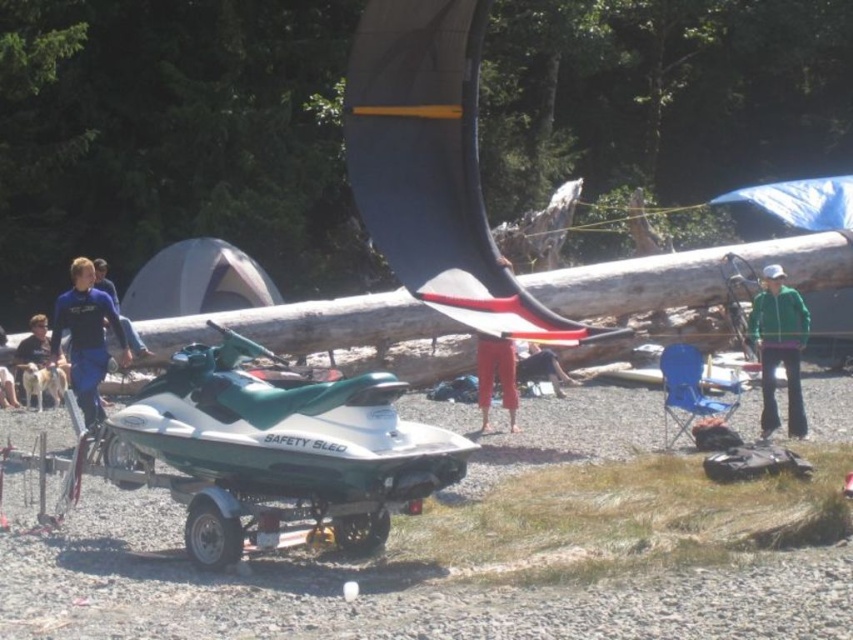
You are a photographer planning to capture a group photo of the blue wetsuit at left and the red cotton pants at center. Since you want to ensure both are visible in the frame, which clothing item should you focus on first to adjust the camera angle?

The blue wetsuit at left has a lesser height compared to red cotton pants at center, so you should focus on adjusting the camera angle to ensure the shorter blue wetsuit at left is visible in the frame.

You are a photographer positioned at the center of the scene. You want to capture a photo that includes both the dark blue fabric pants at center and the dark blue wetsuit at lower left. Given that your camera has a 50mm lens with a field of view that can capture objects within a 30 feet range, will you be able to include both subjects in the same frame?

The dark blue fabric pants at center is 18.33 feet from the dark blue wetsuit at lower left. Since the distance between them is within the 30 feet range of the camera lens, both subjects can be included in the same frame.

Consider the image. You are standing at the point labeled as point (86, 337) in the image. What object or person are you facing?

The point labeled (86, 337) corresponds to the blue wetsuit at left, so you are facing the blue wetsuit at left.